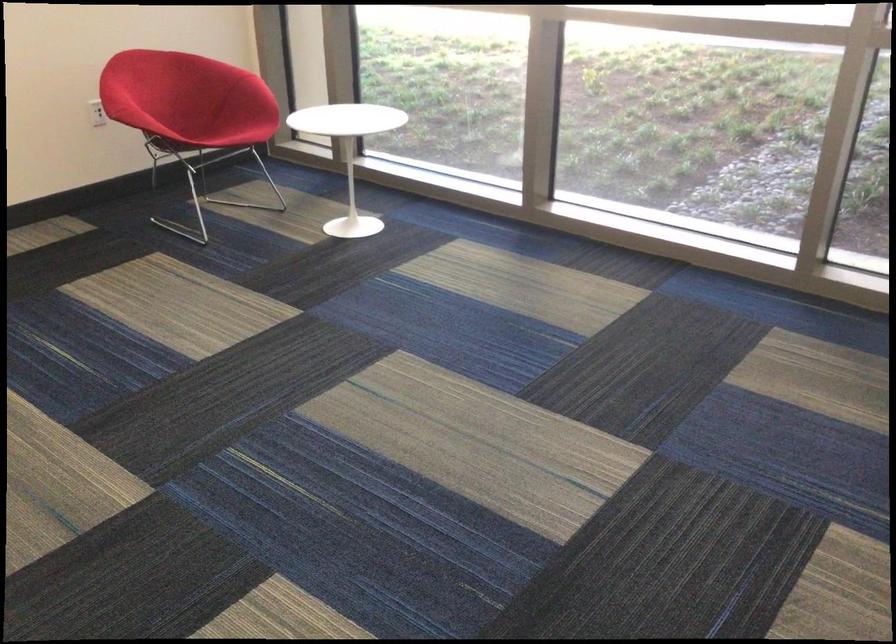
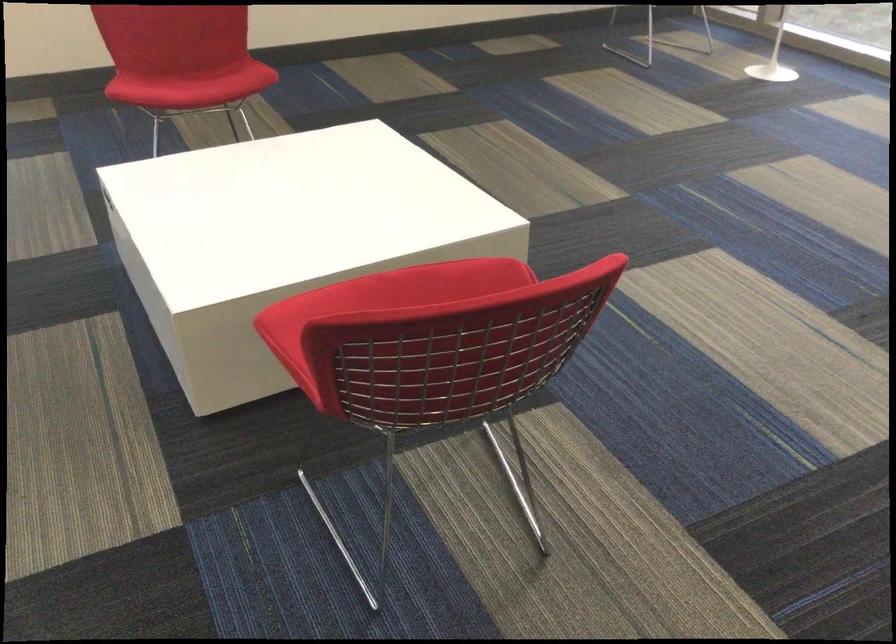
Question: In a continuous first-person perspective shot, in which direction is the camera moving?

Choices:
 (A) Left
 (B) Right
 (C) Forward
 (D) Backward

Answer: (D)